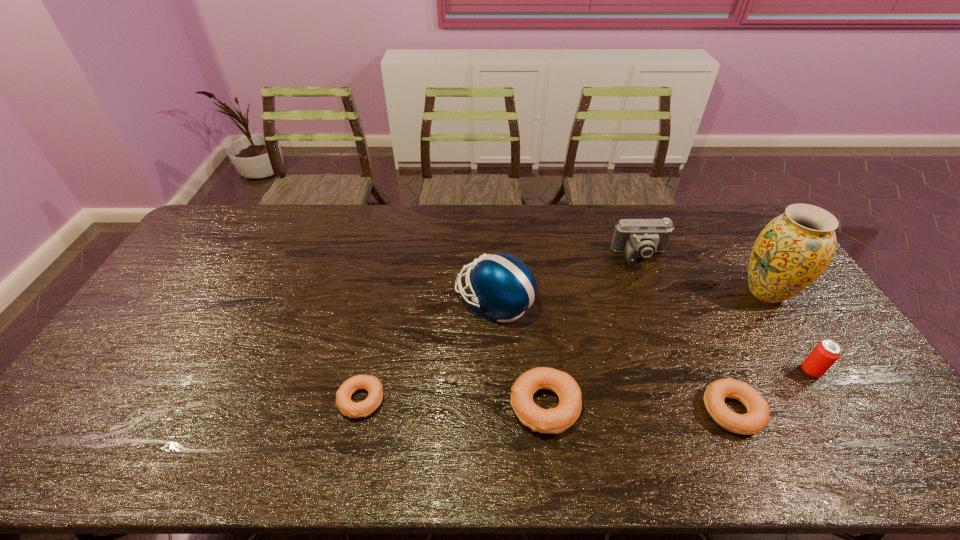
In order to click on the leftmost bagel in this screenshot , I will do `click(347, 407)`.

Where is `the leftmost object`? Image resolution: width=960 pixels, height=540 pixels. the leftmost object is located at coordinates (347, 407).

At what (x,y) coordinates should I click in order to perform the action: click on the tallest bagel. Please return your answer as a coordinate pair (x, y). Image resolution: width=960 pixels, height=540 pixels. Looking at the image, I should click on (555, 420).

Identify the location of the second bagel from right to left. The image size is (960, 540). (555, 420).

Locate an element on the screen. This screenshot has height=540, width=960. the rightmost bagel is located at coordinates (758, 411).

What are the coordinates of `the second shortest object` in the screenshot? It's located at (758, 411).

Locate an element on the screen. The image size is (960, 540). camera is located at coordinates (641, 238).

This screenshot has height=540, width=960. What are the coordinates of `the fourth tallest object` in the screenshot? It's located at (825, 354).

This screenshot has width=960, height=540. I want to click on football helmet, so click(503, 287).

Find the location of a particular element. The image size is (960, 540). the tallest object is located at coordinates (795, 248).